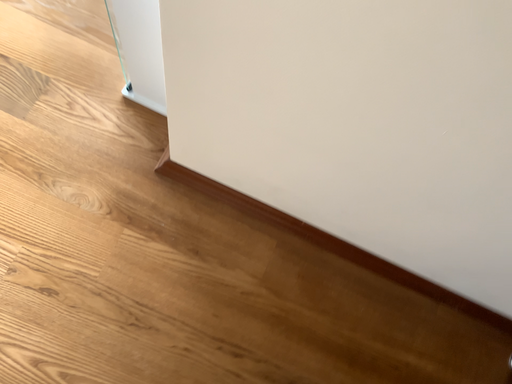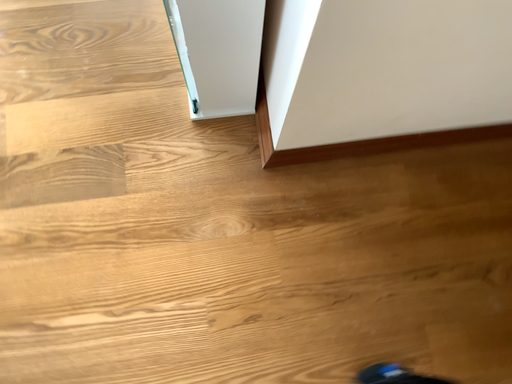
Question: How did the camera likely rotate when shooting the video?

Choices:
 (A) rotated upward
 (B) rotated downward

Answer: (B)